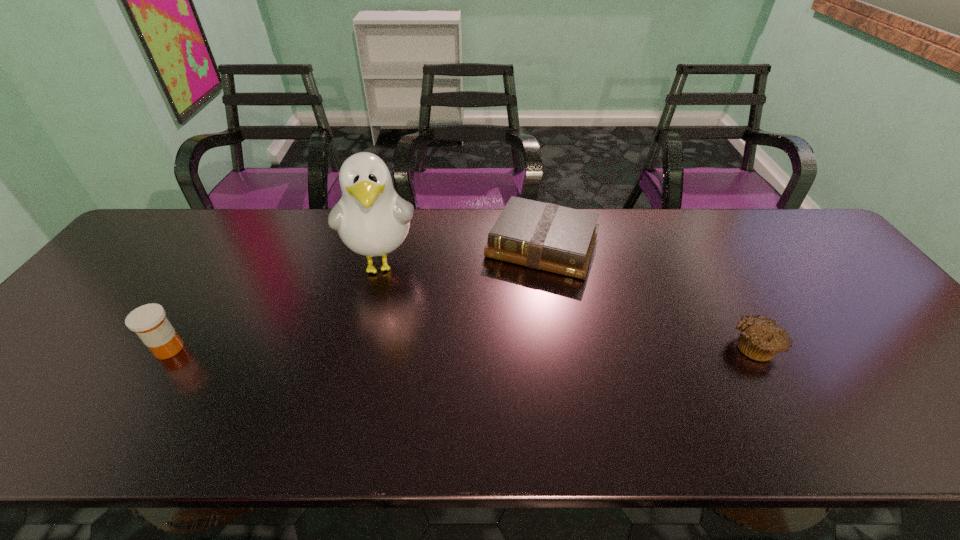
Identify the location of the third shortest object. (149, 322).

You are a GUI agent. You are given a task and a screenshot of the screen. Output one action in this format:
    pyautogui.click(x=<x>, y=<y>)
    Task: Click on the medicine
    The width and height of the screenshot is (960, 540).
    Given the screenshot: What is the action you would take?
    pyautogui.click(x=149, y=322)

Identify the location of the rightmost object. Image resolution: width=960 pixels, height=540 pixels. (761, 339).

The width and height of the screenshot is (960, 540). Identify the location of the second object from right to left. (545, 236).

You are a GUI agent. You are given a task and a screenshot of the screen. Output one action in this format:
    pyautogui.click(x=<x>, y=<y>)
    Task: Click on the second object from left to right
    This screenshot has width=960, height=540.
    Given the screenshot: What is the action you would take?
    pyautogui.click(x=371, y=219)

The width and height of the screenshot is (960, 540). Find the location of `the tallest object`. the tallest object is located at coordinates (371, 219).

What are the coordinates of `vacant space located 0.120m on the label of the medicine` in the screenshot? It's located at (235, 349).

Locate an element on the screen. vacant space located on the right of the muffin is located at coordinates (845, 346).

Identify the location of free space located on the spine side of the Bible. The image size is (960, 540). pyautogui.click(x=516, y=304).

Find the location of `free space located 0.240m on the spine side of the Bible`. free space located 0.240m on the spine side of the Bible is located at coordinates (500, 344).